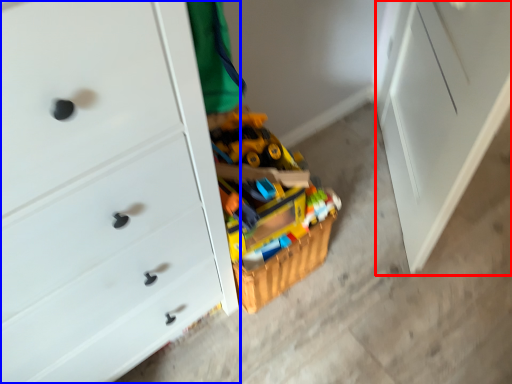
Question: Which point is further to the camera, file cabinet (highlighted by a red box) or chest of drawers (highlighted by a blue box)?

Choices:
 (A) file cabinet
 (B) chest of drawers

Answer: (A)